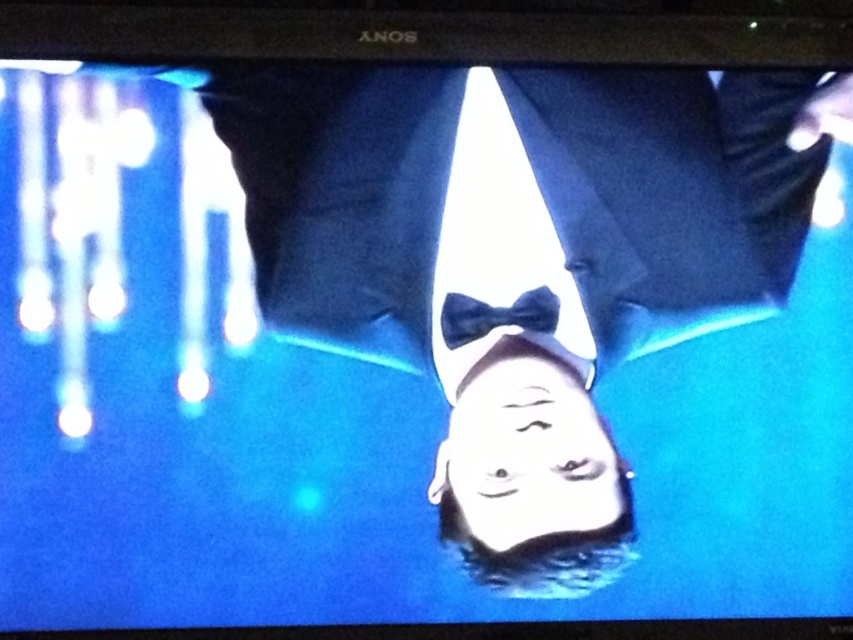
You are a tailor measuring the distance between two bow ties on a character in a TV show scene. The scene has a smooth black bow tie at center and a velvet blue bow tie at center. The TV screen is 50 cm wide. Can the two bow ties fit side by side horizontally without overlapping?

The distance between the smooth black bow tie at center and velvet blue bow tie at center is 15.32 centimeters. Since the TV screen is 50 cm wide, there is enough space for both bow ties to fit side by side without overlapping.

You are an assistant helping to style a character for a formal event. The character currently has both a smooth black bow tie at center and a velvet blue bow tie at center. Which bow tie is visible on top?

The smooth black bow tie at center is positioned over the velvet blue bow tie at center, so the smooth black bow tie at center is visible on top.